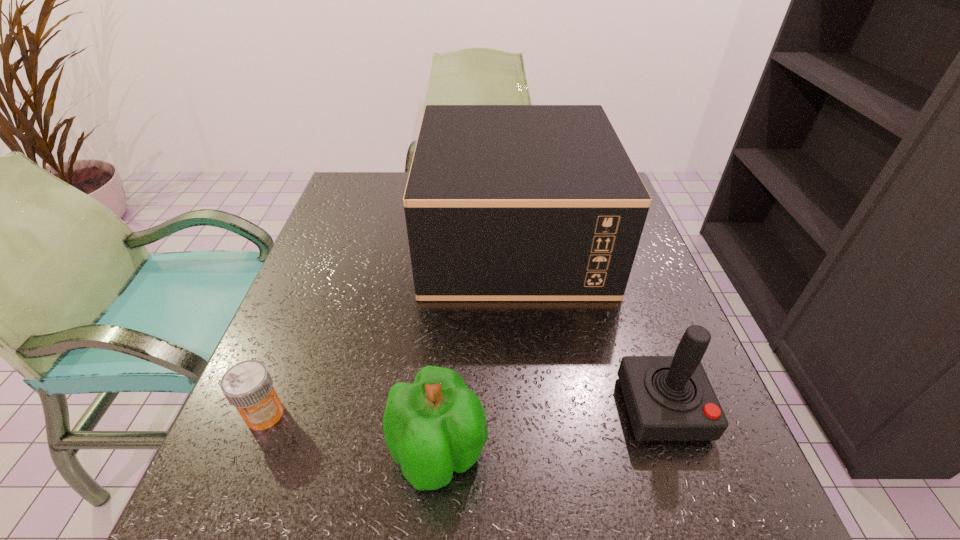
At what (x,y) coordinates should I click in order to perform the action: click on the farthest object. Please return your answer as a coordinate pair (x, y). The height and width of the screenshot is (540, 960). Looking at the image, I should click on (503, 202).

Where is `box`? The width and height of the screenshot is (960, 540). box is located at coordinates (503, 202).

Where is `joystick`? joystick is located at coordinates (669, 398).

Locate an element on the screen. The width and height of the screenshot is (960, 540). bell pepper is located at coordinates click(x=436, y=425).

Identify the location of the shortest object. This screenshot has width=960, height=540. (248, 386).

Where is `medicine`? medicine is located at coordinates (248, 386).

You are a GUI agent. You are given a task and a screenshot of the screen. Output one action in this format:
    pyautogui.click(x=<x>, y=<y>)
    Task: Click on the vacant space positioned 0.180m on the front-facing side of the box
    
    Given the screenshot: What is the action you would take?
    pyautogui.click(x=352, y=239)

Find the location of a particular element. The width and height of the screenshot is (960, 540). vacant space positioned on the front-facing side of the box is located at coordinates (385, 239).

At what (x,y) coordinates should I click in order to perform the action: click on vacant space located on the front-facing side of the box. Please return your answer as a coordinate pair (x, y). The image size is (960, 540). Looking at the image, I should click on (393, 239).

Image resolution: width=960 pixels, height=540 pixels. In order to click on vacant area situated 0.080m on the base of the joystick in this screenshot , I will do `click(694, 497)`.